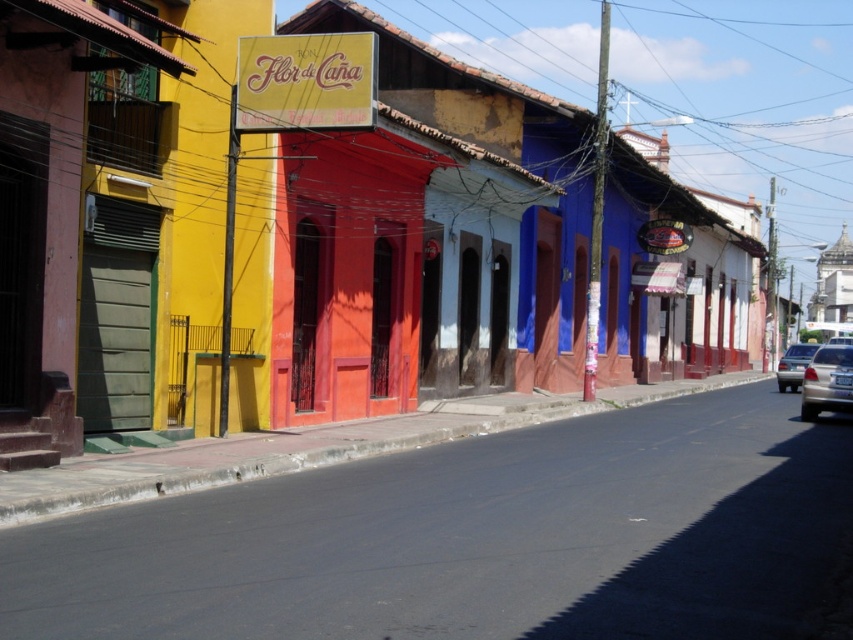
Is silver metallic car at lower right further to camera compared to satin silver sedan at lower right?

That is False.

The height and width of the screenshot is (640, 853). Find the location of `silver metallic car at lower right`. silver metallic car at lower right is located at coordinates (827, 381).